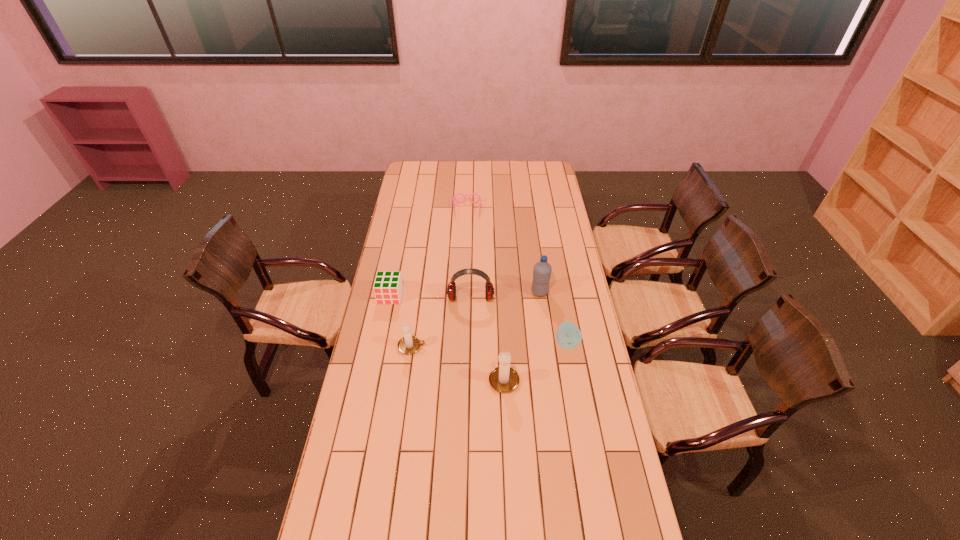
Locate an element on the screen. This screenshot has height=540, width=960. cube situated at the left edge is located at coordinates (388, 287).

The image size is (960, 540). I want to click on apple present at the right edge, so click(568, 336).

What are the coordinates of `water bottle situated at the right edge` in the screenshot? It's located at (542, 270).

Where is `vacant space at the far edge of the desktop`? The height and width of the screenshot is (540, 960). vacant space at the far edge of the desktop is located at coordinates (520, 181).

In the image, there is a desktop. At what (x,y) coordinates should I click in order to perform the action: click on free space at the left edge. Please return your answer as a coordinate pair (x, y). Looking at the image, I should click on (374, 386).

In the image, there is a desktop. Where is `free space at the right edge`? Image resolution: width=960 pixels, height=540 pixels. free space at the right edge is located at coordinates (572, 359).

Find the location of a particular element. vacant space at the far left corner of the desktop is located at coordinates (428, 181).

In the image, there is a desktop. At what (x,y) coordinates should I click in order to perform the action: click on vacant area at the far right corner. Please return your answer as a coordinate pair (x, y). This screenshot has height=540, width=960. Looking at the image, I should click on (534, 170).

I want to click on vacant area that lies between the farthest object and the shorter candle holder, so click(440, 279).

Locate an element on the screen. This screenshot has width=960, height=540. free space between the tallest object and the shortest object is located at coordinates (503, 251).